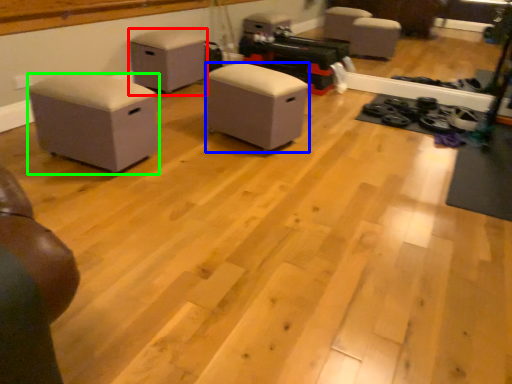
Question: Which is nearer to the furniture (highlighted by a red box)? furniture (highlighted by a blue box) or furniture (highlighted by a green box).

Choices:
 (A) furniture
 (B) furniture

Answer: (A)